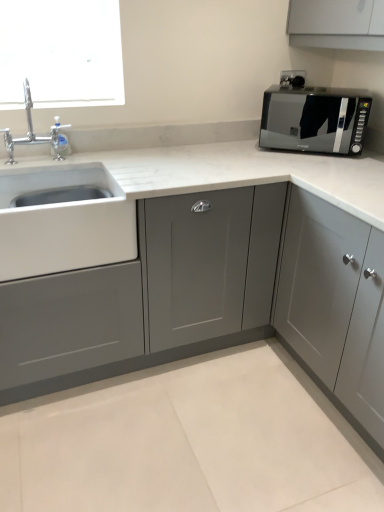
Question: Considering the relative sizes of black glossy microwave at upper right and matte gray cabinet at center, acting as the second cabinetry starting from the right, in the image provided, is black glossy microwave at upper right taller than matte gray cabinet at center, acting as the second cabinetry starting from the right,?

Choices:
 (A) no
 (B) yes

Answer: (A)

Question: Is black glossy microwave at upper right located outside matte gray cabinet at center, placed as the first cabinetry when sorted from left to right?

Choices:
 (A) no
 (B) yes

Answer: (B)

Question: Does black glossy microwave at upper right have a greater width compared to matte gray cabinet at center, acting as the second cabinetry starting from the right?

Choices:
 (A) no
 (B) yes

Answer: (A)

Question: Considering the relative sizes of black glossy microwave at upper right and matte gray cabinet at center, placed as the first cabinetry when sorted from left to right, in the image provided, is black glossy microwave at upper right thinner than matte gray cabinet at center, placed as the first cabinetry when sorted from left to right,?

Choices:
 (A) yes
 (B) no

Answer: (A)

Question: From the image's perspective, is black glossy microwave at upper right under matte gray cabinet at center, placed as the first cabinetry when sorted from left to right?

Choices:
 (A) no
 (B) yes

Answer: (A)

Question: Is point (29, 189) positioned closer to the camera than point (324, 296)?

Choices:
 (A) farther
 (B) closer

Answer: (A)

Question: Do you think white matte sink at left is within matte gray cabinet at upper right, arranged as the second cabinetry when viewed from the left, or outside of it?

Choices:
 (A) inside
 (B) outside

Answer: (B)

Question: Is white matte sink at left bigger or smaller than matte gray cabinet at upper right, which is the first cabinetry in right-to-left order?

Choices:
 (A) small
 (B) big

Answer: (A)

Question: Based on their positions, is white matte sink at left located to the left or right of matte gray cabinet at upper right, which is the first cabinetry in right-to-left order?

Choices:
 (A) left
 (B) right

Answer: (A)

Question: Considering their positions, is black glossy microwave at upper right located in front of or behind chrome metallic faucet at upper left?

Choices:
 (A) front
 (B) behind

Answer: (B)

Question: In terms of width, does black glossy microwave at upper right look wider or thinner when compared to chrome metallic faucet at upper left?

Choices:
 (A) thin
 (B) wide

Answer: (B)

Question: Considering the relative positions of black glossy microwave at upper right and chrome metallic faucet at upper left in the image provided, is black glossy microwave at upper right to the left or to the right of chrome metallic faucet at upper left?

Choices:
 (A) left
 (B) right

Answer: (B)

Question: From the image's perspective, is black glossy microwave at upper right located above or below chrome metallic faucet at upper left?

Choices:
 (A) above
 (B) below

Answer: (A)

Question: From the image's perspective, is chrome metallic faucet at upper left above or below matte gray cabinet at center, acting as the second cabinetry starting from the right?

Choices:
 (A) above
 (B) below

Answer: (A)

Question: From their relative heights in the image, would you say chrome metallic faucet at upper left is taller or shorter than matte gray cabinet at center, placed as the first cabinetry when sorted from left to right?

Choices:
 (A) short
 (B) tall

Answer: (A)